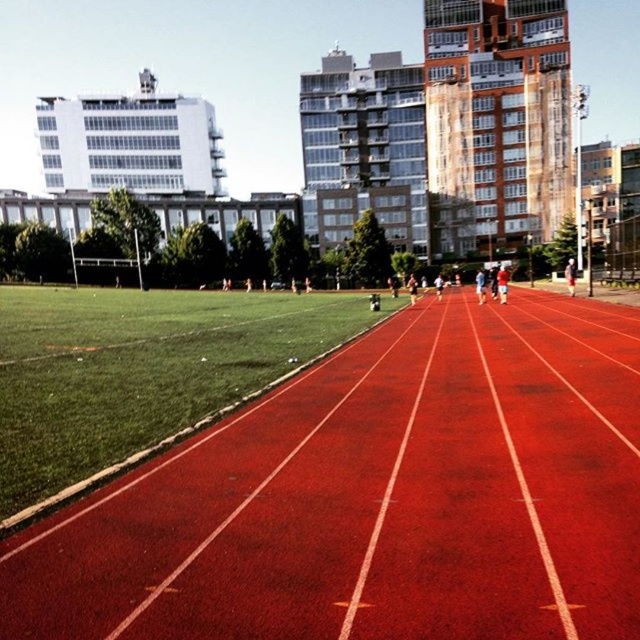
Question: Which object appears farthest from the camera in this image?

Choices:
 (A) red fabric shorts at center
 (B) smooth white shirt at center
 (C) matte red track at center

Answer: (A)

Question: Does rubberized red track at center have a smaller size compared to red fabric shorts at center?

Choices:
 (A) yes
 (B) no

Answer: (A)

Question: In this image, where is rubberized red track at center located relative to red fabric shorts at center?

Choices:
 (A) right
 (B) left

Answer: (B)

Question: Which object is the farthest from the matte red track at center?

Choices:
 (A) smooth white shirt at center
 (B) rubberized red track at center
 (C) red fabric shorts at center

Answer: (B)

Question: Which point is farther from the camera taking this photo?

Choices:
 (A) (499, 266)
 (B) (484, 289)

Answer: (A)

Question: Can you confirm if matte red track at center is wider than smooth white shirt at center?

Choices:
 (A) no
 (B) yes

Answer: (B)